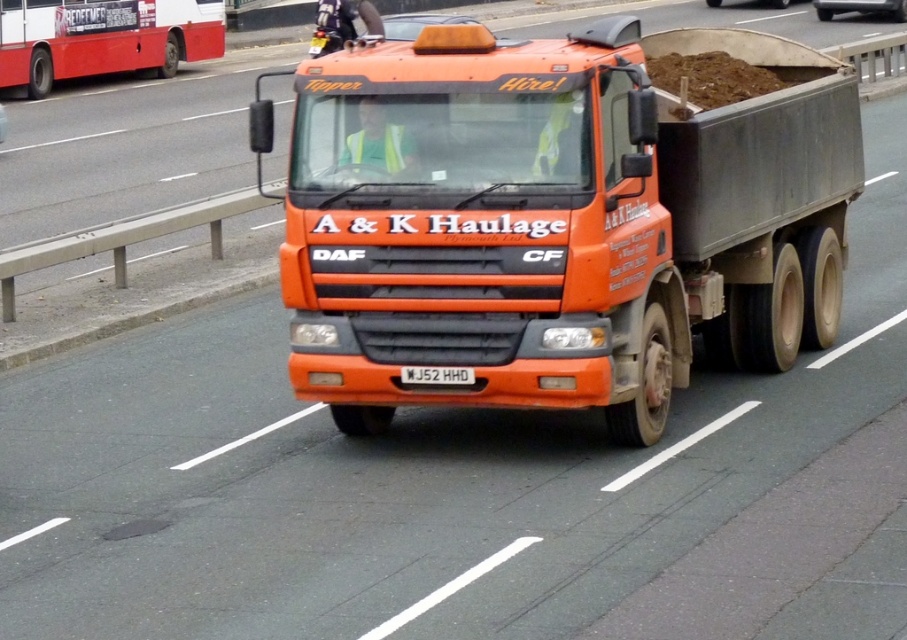
Does orange matte truck at center have a lesser width compared to white plastic license plate at center?

In fact, orange matte truck at center might be wider than white plastic license plate at center.

Is point (291, 144) closer to viewer compared to point (471, 381)?

That is False.

I want to click on orange matte truck at center, so click(558, 220).